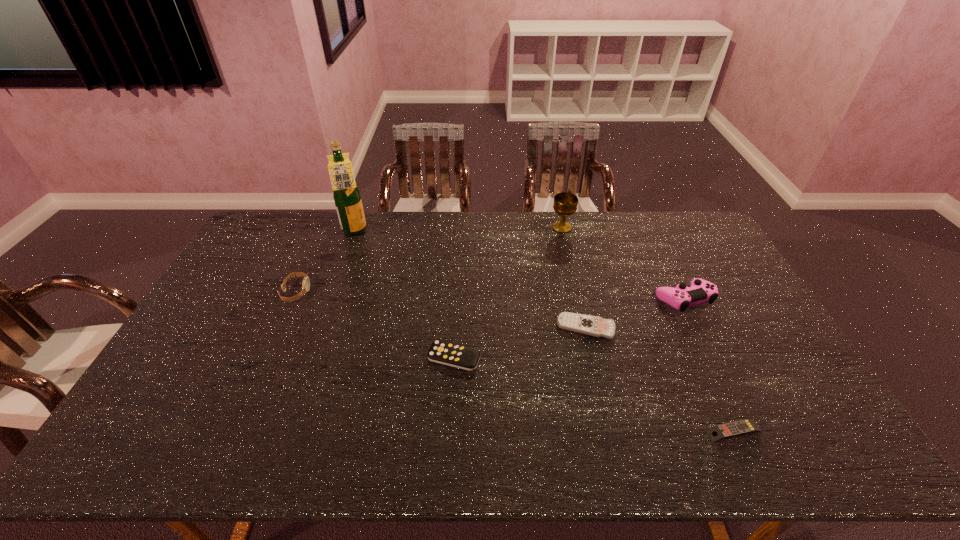
I want to click on remote control that stands as the third closest to the fourth shortest object, so click(x=746, y=426).

Identify the location of free spot that satisfies the following two spatial constraints: 1. on the back side of the fifth shortest object; 2. on the left side of the sixth farthest object. The width and height of the screenshot is (960, 540). (457, 299).

Identify the location of vacant space that satisfies the following two spatial constraints: 1. on the back side of the control; 2. on the front-facing side of the second object from left to right. This screenshot has width=960, height=540. (651, 232).

This screenshot has height=540, width=960. I want to click on free space that satisfies the following two spatial constraints: 1. on the front-facing side of the leftmost remote control; 2. on the left side of the sixth object from right to left, so pyautogui.click(x=311, y=357).

Identify the location of free space that satisfies the following two spatial constraints: 1. on the face of the farthest remote control; 2. on the left side of the watch. This screenshot has height=540, width=960. (280, 328).

You are a GUI agent. You are given a task and a screenshot of the screen. Output one action in this format:
    pyautogui.click(x=<x>, y=<y>)
    Task: Click on the free space that satisfies the following two spatial constraints: 1. on the face of the rightmost remote control; 2. on the right side of the watch
    
    Given the screenshot: What is the action you would take?
    pyautogui.click(x=234, y=431)

The image size is (960, 540). I want to click on vacant space that satisfies the following two spatial constraints: 1. on the back side of the leftmost remote control; 2. on the front-facing side of the tallest object, so click(x=461, y=232).

Identify the location of vacant area that satisfies the following two spatial constraints: 1. on the back side of the fifth shortest object; 2. on the front-facing side of the liquor. (651, 232).

This screenshot has width=960, height=540. I want to click on free spot that satisfies the following two spatial constraints: 1. on the face of the second remote control from left to right; 2. on the left side of the leftmost object, so click(280, 328).

Locate an element on the screen. This screenshot has height=540, width=960. blank space that satisfies the following two spatial constraints: 1. on the front-facing side of the tallest object; 2. on the right side of the rightmost remote control is located at coordinates (284, 431).